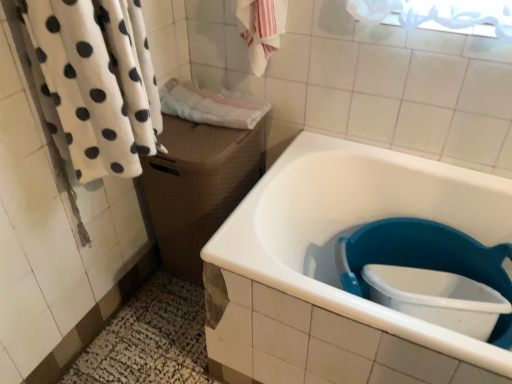
Question: Do you think white glossy bathtub at lower right is within white fluffy towel at left, arranged as the 3th bath towel when viewed from the back, or outside of it?

Choices:
 (A) outside
 (B) inside

Answer: (A)

Question: Considering the positions of white glossy bathtub at lower right and white fluffy towel at left, arranged as the 3th bath towel when viewed from the back, in the image, is white glossy bathtub at lower right wider or thinner than white fluffy towel at left, arranged as the 3th bath towel when viewed from the back,?

Choices:
 (A) thin
 (B) wide

Answer: (B)

Question: Based on their relative distances, which object is farther from the brown woven box at center?

Choices:
 (A) white glossy bathtub at lower right
 (B) white striped fabric at upper center, which is counted as the 2th bath towel, starting from the front
 (C) white fluffy towel at left, which appears as the 1th bath towel when viewed from the front
 (D) pink terry cloth towel at center, marked as the first bath towel in a back-to-front arrangement

Answer: (B)

Question: Which object is positioned farthest from the white fluffy towel at left, arranged as the 3th bath towel when viewed from the back?

Choices:
 (A) white striped fabric at upper center, which is counted as the 2th bath towel, starting from the front
 (B) pink terry cloth towel at center, the third bath towel in the front-to-back sequence
 (C) white glossy bathtub at lower right
 (D) brown woven box at center

Answer: (A)